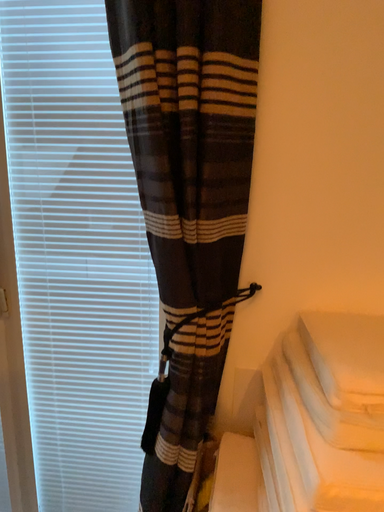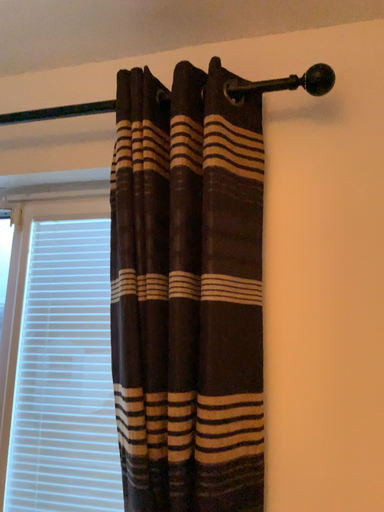
Question: How did the camera likely rotate when shooting the video?

Choices:
 (A) rotated left
 (B) rotated right

Answer: (A)